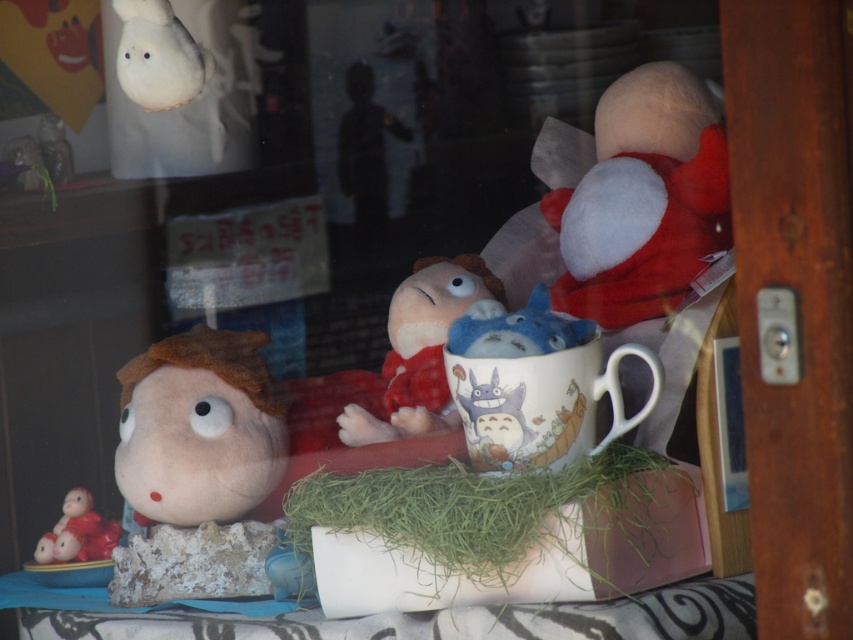
Question: Which point is farther from the camera taking this photo?

Choices:
 (A) (563, 355)
 (B) (578, 289)
 (C) (71, 548)

Answer: (C)

Question: Is white plush toy at upper right above fuzzy beige doll at left?

Choices:
 (A) yes
 (B) no

Answer: (A)

Question: Can you confirm if white plush toy at upper right is positioned above matte red figurine at lower left?

Choices:
 (A) yes
 (B) no

Answer: (A)

Question: Which is farther from the matte red figurine at lower left?

Choices:
 (A) white glossy mug at center
 (B) green grassy hay at center
 (C) fuzzy beige doll at left
 (D) white plush toy at upper right

Answer: (D)

Question: Can you confirm if white plush toy at upper right is thinner than fuzzy beige doll at left?

Choices:
 (A) yes
 (B) no

Answer: (B)

Question: Which object is farther from the camera taking this photo?

Choices:
 (A) white plush toy at upper right
 (B) fuzzy beige doll at left

Answer: (A)